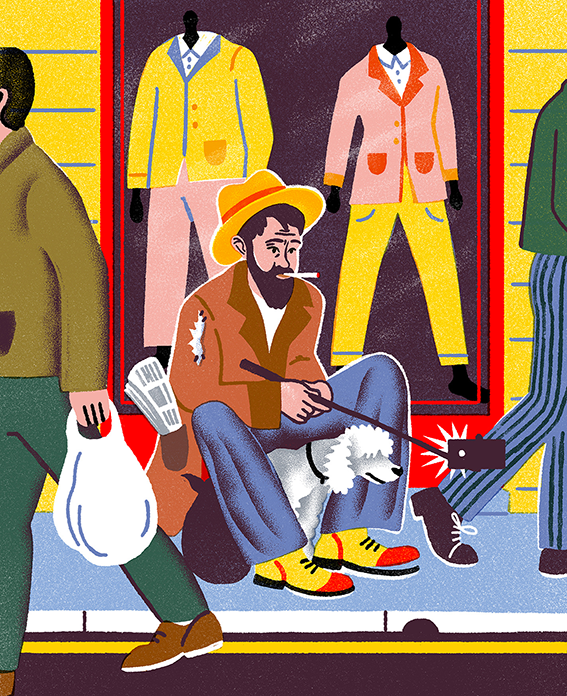
Image resolution: width=567 pixels, height=696 pixels. I want to click on window, so click(x=472, y=81).